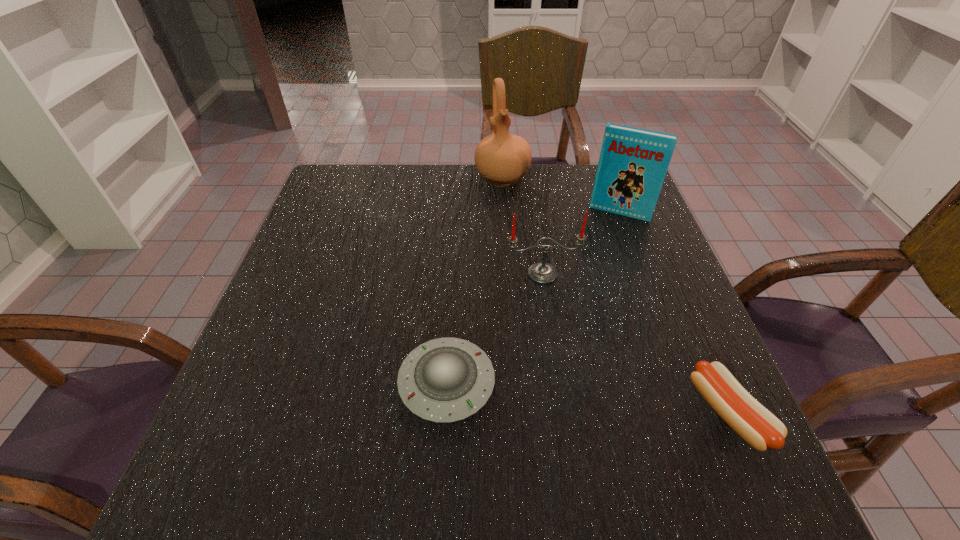
I want to click on sausage located in the near edge section of the desktop, so click(x=756, y=425).

You are a GUI agent. You are given a task and a screenshot of the screen. Output one action in this format:
    pyautogui.click(x=<x>, y=<y>)
    Task: Click on the sausage that is at the right edge
    The image size is (960, 540).
    Given the screenshot: What is the action you would take?
    pyautogui.click(x=756, y=425)

You are a GUI agent. You are given a task and a screenshot of the screen. Output one action in this format:
    pyautogui.click(x=<x>, y=<y>)
    Task: Click on the book located in the right edge section of the desktop
    
    Given the screenshot: What is the action you would take?
    pyautogui.click(x=633, y=162)

Locate an element on the screen. The width and height of the screenshot is (960, 540). object at the far right corner is located at coordinates (633, 162).

The height and width of the screenshot is (540, 960). In order to click on object located at the near right corner in this screenshot , I will do `click(756, 425)`.

This screenshot has width=960, height=540. What are the coordinates of `vacant area at the far edge of the desktop` in the screenshot? It's located at (492, 205).

In the image, there is a desktop. Identify the location of free space at the near edge. (428, 427).

Where is `blank space at the left edge of the desktop`? blank space at the left edge of the desktop is located at coordinates (301, 306).

You are a GUI agent. You are given a task and a screenshot of the screen. Output one action in this format:
    pyautogui.click(x=<x>, y=<y>)
    Task: Click on the free space at the far left corner
    Image resolution: width=960 pixels, height=540 pixels.
    Given the screenshot: What is the action you would take?
    pyautogui.click(x=368, y=180)

Image resolution: width=960 pixels, height=540 pixels. Find the location of `free space between the candle and the farthest object`. free space between the candle and the farthest object is located at coordinates (522, 226).